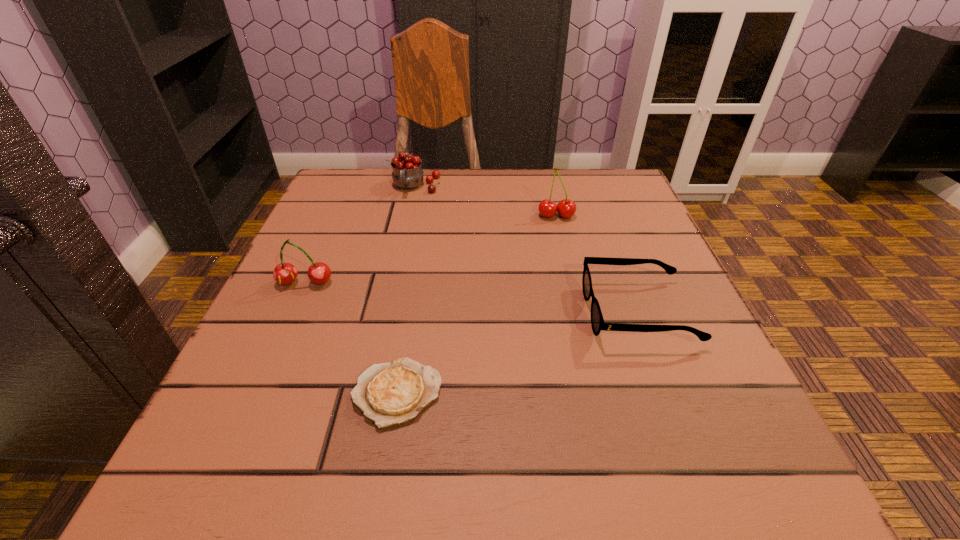
The image size is (960, 540). I want to click on the farthest object, so click(x=407, y=174).

This screenshot has width=960, height=540. In order to click on the second cherry from left to right in this screenshot , I will do `click(407, 174)`.

I want to click on the rightmost cherry, so click(x=566, y=208).

Locate an element on the screen. the second farthest object is located at coordinates (566, 208).

The width and height of the screenshot is (960, 540). I want to click on the nearest cherry, so pos(285,273).

The height and width of the screenshot is (540, 960). Find the location of `the leftmost object`. the leftmost object is located at coordinates (285, 273).

Where is `spectacles`? spectacles is located at coordinates (597, 322).

Find the location of a particular element. the nearest object is located at coordinates (392, 393).

Where is `quiche`? The image size is (960, 540). quiche is located at coordinates (392, 393).

I want to click on blank space located 0.090m on the handle side of the second cherry from left to right, so click(409, 220).